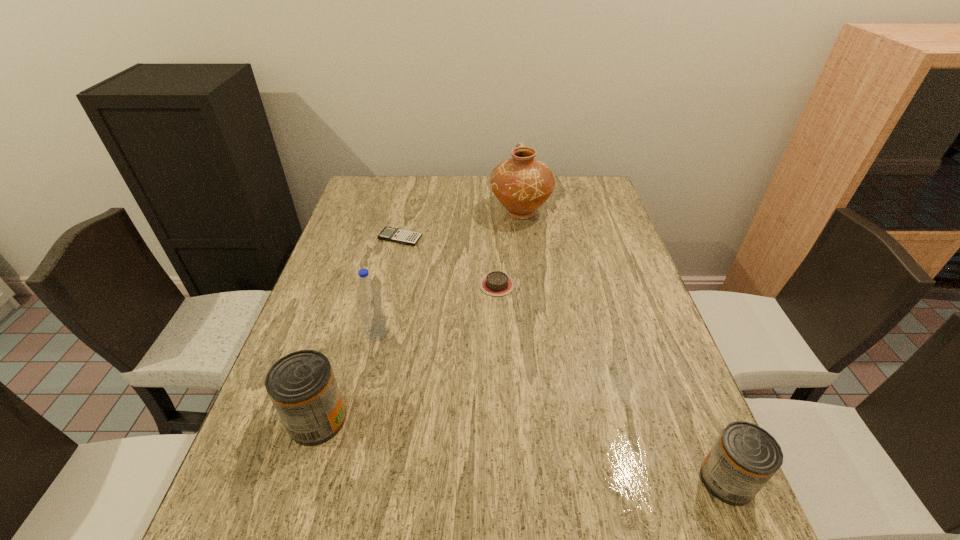
At what (x,y) coordinates should I click in order to perform the action: click on calculator that is at the left edge. Please return your answer as a coordinate pair (x, y). The image size is (960, 540). Looking at the image, I should click on (401, 236).

This screenshot has height=540, width=960. Identify the location of water bottle located in the left edge section of the desktop. (372, 314).

Locate an element on the screen. The image size is (960, 540). object that is positioned at the right edge is located at coordinates (745, 456).

This screenshot has width=960, height=540. What are the coordinates of `object that is positioned at the near right corner` in the screenshot? It's located at (745, 456).

Identify the location of free location at the far edge. Image resolution: width=960 pixels, height=540 pixels. (469, 205).

Where is `vacant space at the near edge of the desktop`? This screenshot has width=960, height=540. vacant space at the near edge of the desktop is located at coordinates 363,463.

What are the coordinates of `vacant space at the left edge` in the screenshot? It's located at (377, 217).

Find the location of a particular element. Image resolution: width=960 pixels, height=540 pixels. vacant space at the right edge of the desktop is located at coordinates (668, 411).

Where is `free space at the far left corner of the desktop`? The height and width of the screenshot is (540, 960). free space at the far left corner of the desktop is located at coordinates pos(372,197).

The height and width of the screenshot is (540, 960). In the image, there is a desktop. Find the location of `vacant space at the far right corner`. vacant space at the far right corner is located at coordinates (574, 198).